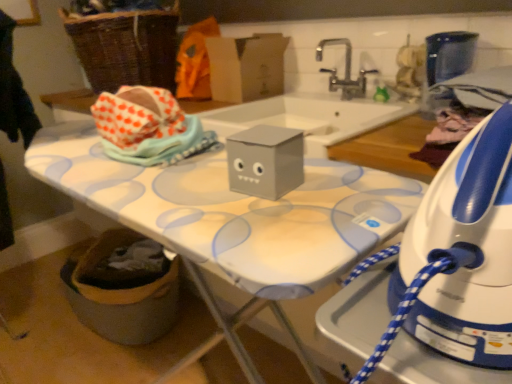
Question: Considering the positions of point 340,39 and point 272,54, is point 340,39 closer or farther from the camera than point 272,54?

Choices:
 (A) closer
 (B) farther

Answer: (A)

Question: From the image's perspective, is silver metallic faucet at upper center above or below cardboard box at upper center?

Choices:
 (A) below
 (B) above

Answer: (A)

Question: Which object is the closest to the orange fabric at upper center?

Choices:
 (A) woven brown basket at upper left
 (B) cardboard box at upper center
 (C) gray matte box at center
 (D) white plastic iron at right
 (E) silver metallic faucet at upper center

Answer: (B)

Question: Which is nearer to the gray matte box at center?

Choices:
 (A) white plastic iron at right
 (B) woven brown basket at upper left
 (C) cardboard box at upper center
 (D) orange fabric at upper center
 (E) silver metallic faucet at upper center

Answer: (A)